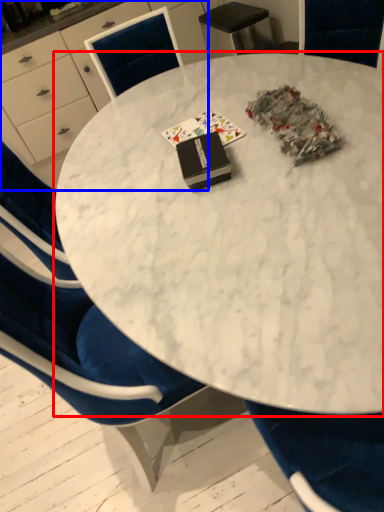
Question: Which object appears farthest to the camera in this image, table (highlighted by a red box) or desk (highlighted by a blue box)?

Choices:
 (A) table
 (B) desk

Answer: (B)